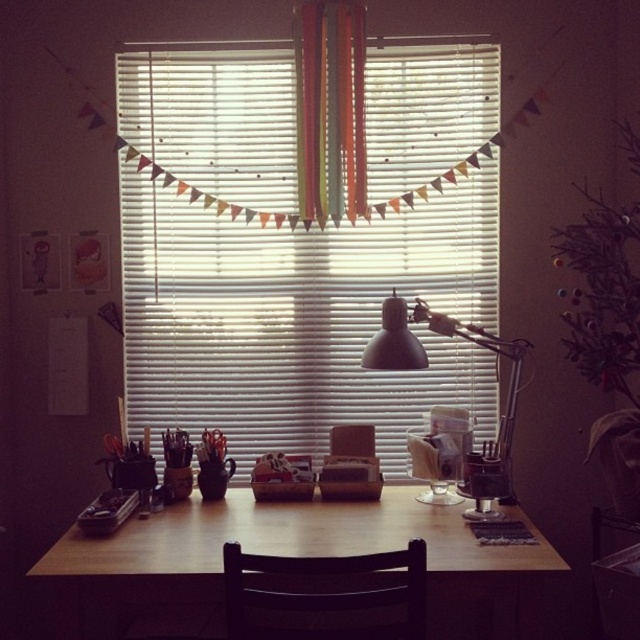
You are standing in front of the desk in the image. There is a point marked at coordinates (300,317). What object is located at this point?

The point at coordinates (300,317) corresponds to the white blinds at center.

You are standing in a room and want to adjust the white blinds at center. If you can reach up to 6 feet, will you be able to reach them?

The white blinds at center are 8.10 feet away from the viewer, so you cannot reach them since your maximum reach is 6 feet.

You are a drone operator trying to capture a photo of two points in a room. The first point is at position point (497,243) and the second point is at point (380,625). If you want to focus on the point that is closer to the camera, which point should you choose?

Point (380,625) is closer to the camera than point (497,243), so you should focus on point (380,625).